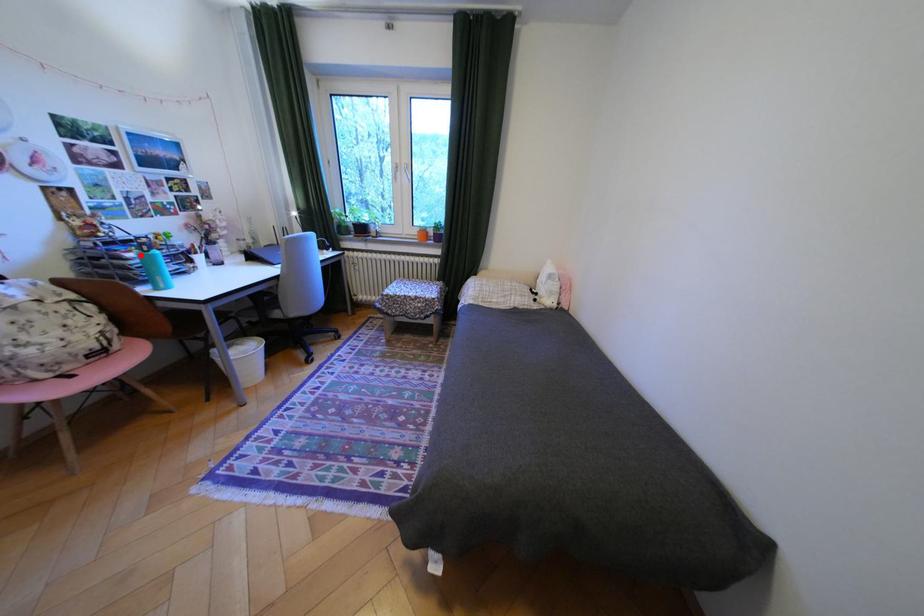
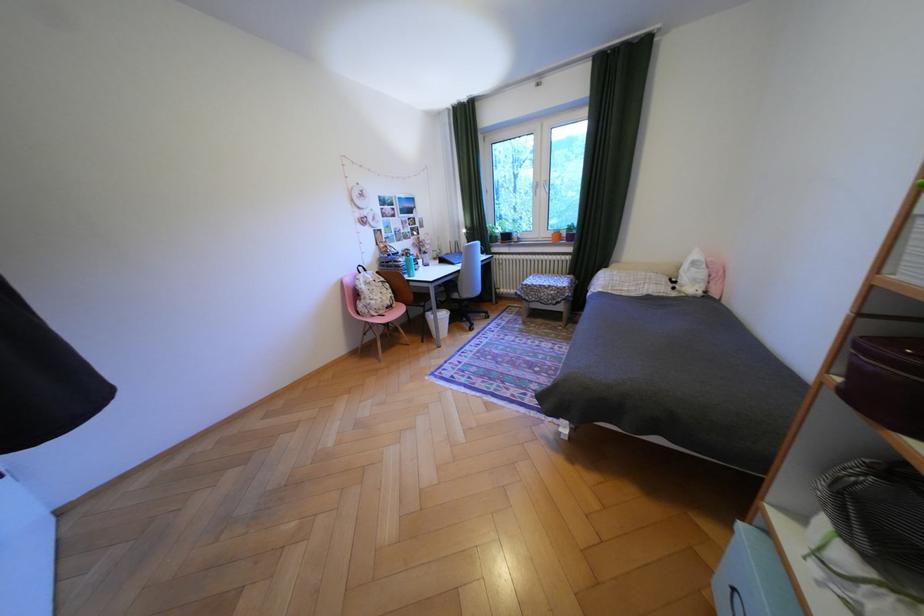
The point at the highlighted location is marked in the first image. Where is the corresponding point in the second image?

(411, 259)